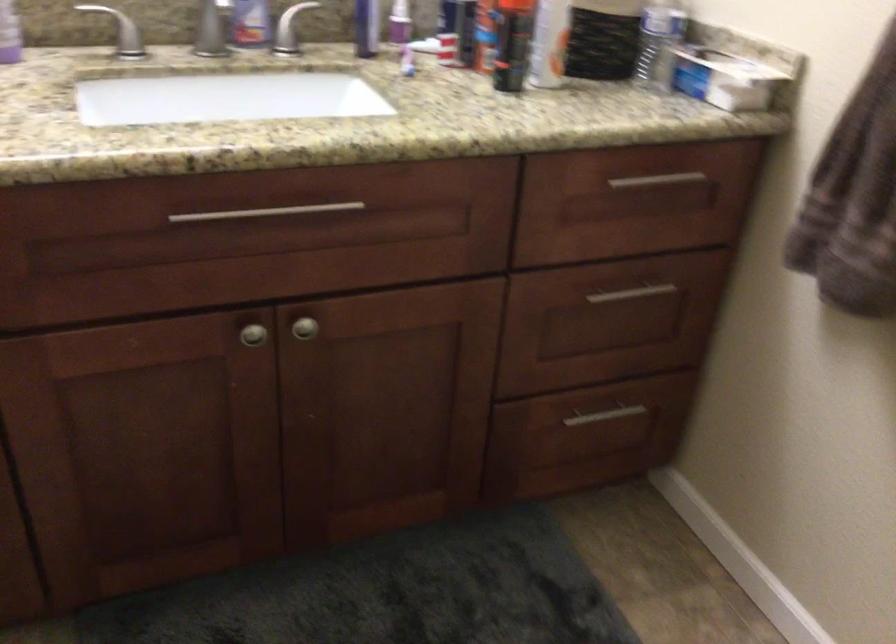
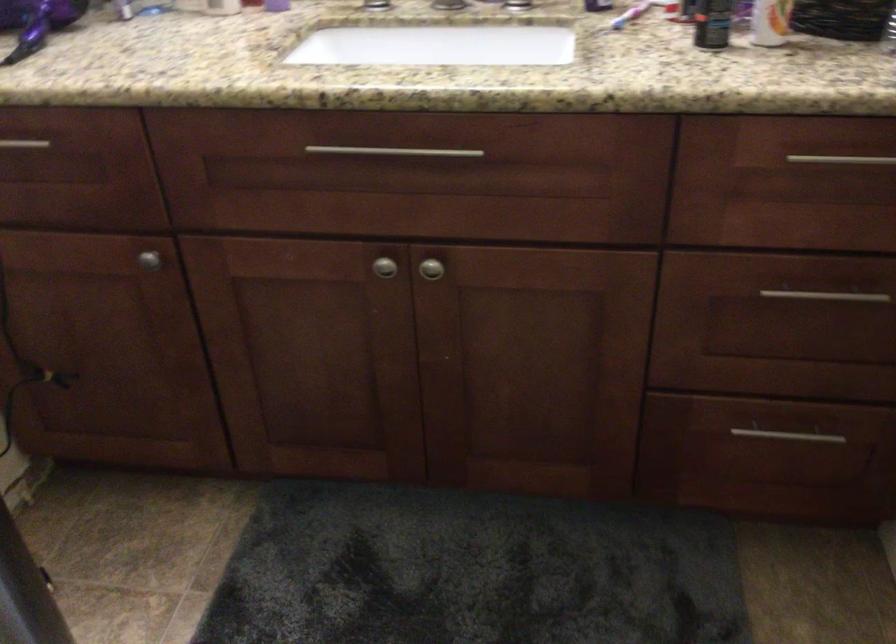
Where in the second image is the point corresponding to [519,73] from the first image?

(712, 23)